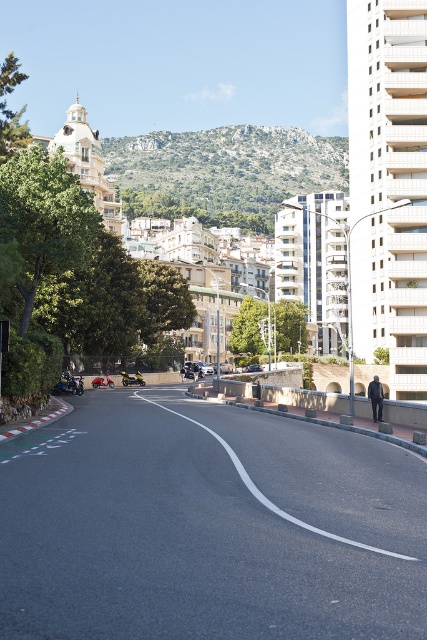
Question: Can you confirm if dark blue leather jacket at lower right is wider than shiny black car at center?

Choices:
 (A) no
 (B) yes

Answer: (A)

Question: Is black asphalt road at center to the left of shiny black car at center from the viewer's perspective?

Choices:
 (A) no
 (B) yes

Answer: (B)

Question: Which of the following is the closest to the observer?

Choices:
 (A) (260, 493)
 (B) (254, 364)
 (C) (227, 362)
 (D) (81, 385)

Answer: (A)

Question: Among these objects, which one is farthest from the camera?

Choices:
 (A) rocky brown hillside at upper center
 (B) shiny black car at center
 (C) shiny chrome motorcycle at lower left
 (D) metallic red scooter at center

Answer: (A)

Question: From the image, what is the correct spatial relationship of metallic silver motorcycle at center in relation to metallic red scooter at center?

Choices:
 (A) right
 (B) left

Answer: (A)

Question: Which object is the farthest from the rocky brown hillside at upper center?

Choices:
 (A) metallic silver motorcycle at center
 (B) black asphalt road at center
 (C) metallic red scooter at center

Answer: (B)